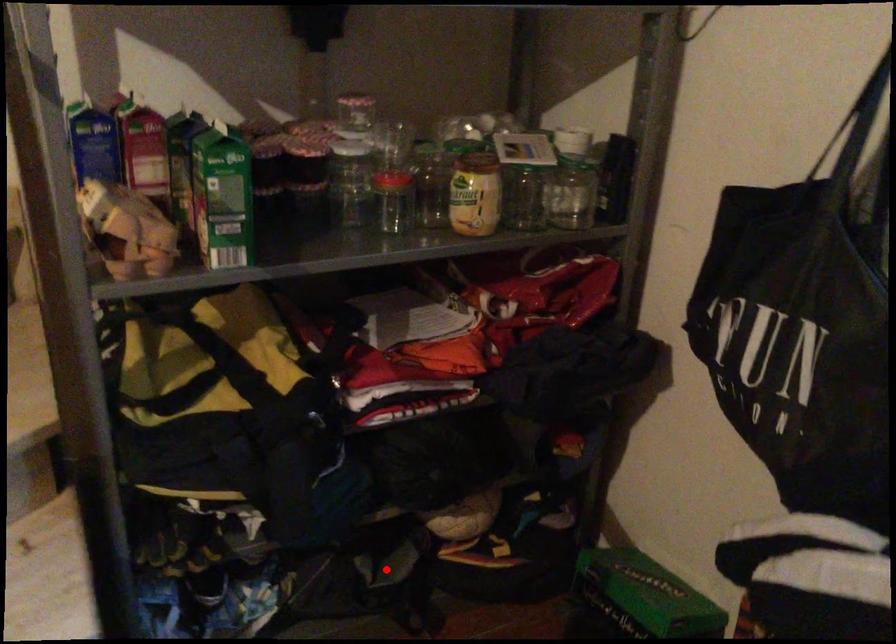
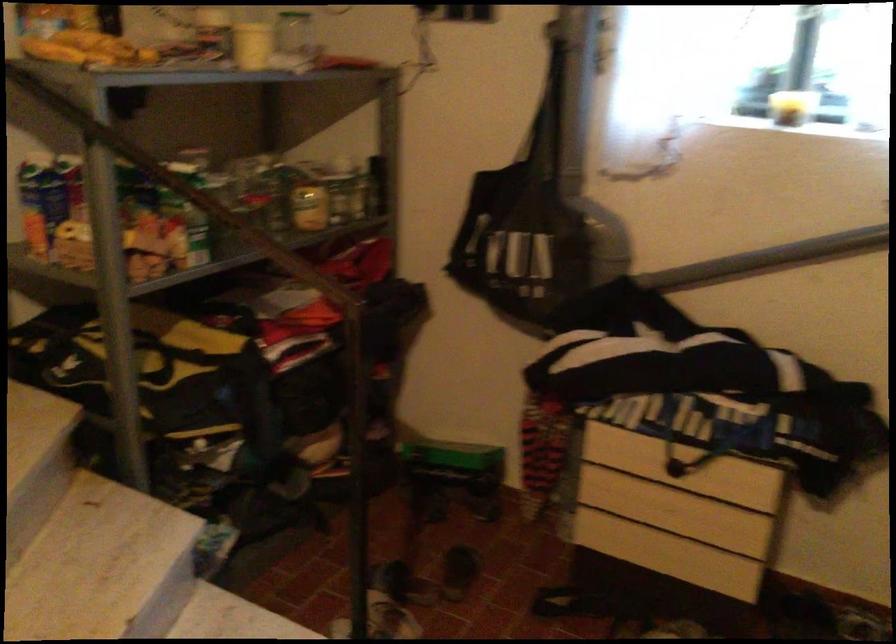
Where in the second image is the point corresponding to the highlighted location from the first image?

(290, 495)